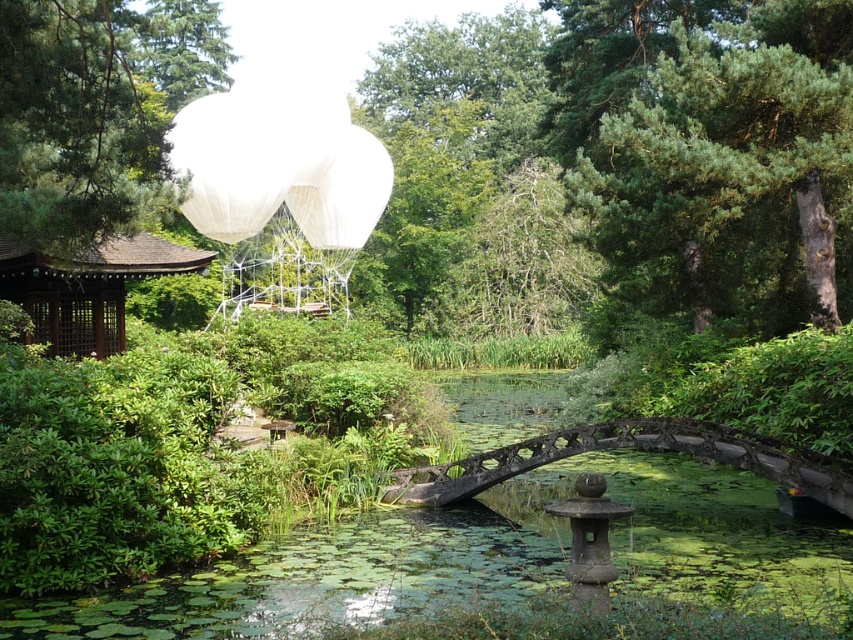
You are a visitor in the garden and want to take a photo of the rusty metal bridge at center and the brown wooden gazebo at left. Which object appears taller in the photo?

The rusty metal bridge at center appears taller in the photo because it has a greater height compared to the brown wooden gazebo at left.

Consider the image. You are standing at the entrance of the garden and want to cross the rusty metal bridge at center. According to the coordinates provided, is the bridge located closer to the center of the garden or near the edge?

The coordinates of the rusty metal bridge at center are at point (631, 448), which places it closer to the center of the garden rather than near the edge.

You are a photographer planning to capture a shot of the garden scene. You want to ensure that both the rusty metal bridge at center and the white matte balloon at center are visible in the frame. Based on their positions, which object should appear lower in the photo?

The rusty metal bridge at center is positioned below the white matte balloon at center, so in the photo, the rusty metal bridge at center will appear lower than the white matte balloon at center.